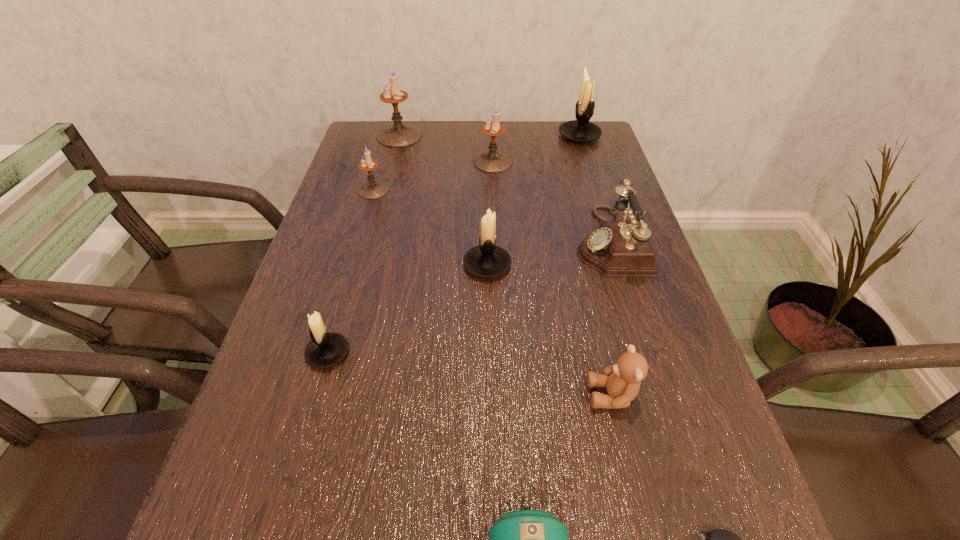
Find the location of a particular element. This screenshot has width=960, height=540. free space located 0.200m on the dial of the telephone is located at coordinates (489, 241).

The image size is (960, 540). I want to click on free space located 0.330m on the right of the smallest purple candle holder, so click(x=513, y=190).

This screenshot has height=540, width=960. Find the location of `vacant space situated on the right of the nearest white candle holder`. vacant space situated on the right of the nearest white candle holder is located at coordinates [x=436, y=353].

Find the location of `vacant region located on the face of the brown teddy bear`. vacant region located on the face of the brown teddy bear is located at coordinates click(x=453, y=395).

Identify the location of free space located on the face of the brown teddy bear. This screenshot has height=540, width=960. (453, 395).

The image size is (960, 540). I want to click on blank space located on the face of the brown teddy bear, so click(x=389, y=395).

At what (x,y) coordinates should I click in order to perform the action: click on candle holder located at the right edge. Please return your answer as a coordinate pair (x, y). The width and height of the screenshot is (960, 540). Looking at the image, I should click on (581, 130).

You are a GUI agent. You are given a task and a screenshot of the screen. Output one action in this format:
    pyautogui.click(x=<x>, y=<y>)
    Task: Click on the telephone present at the right edge
    The height and width of the screenshot is (540, 960).
    Given the screenshot: What is the action you would take?
    pyautogui.click(x=617, y=248)

Image resolution: width=960 pixels, height=540 pixels. Identify the location of teddy bear present at the right edge. (622, 380).

Image resolution: width=960 pixels, height=540 pixels. In order to click on object that is at the far left corner in this screenshot , I will do `click(398, 134)`.